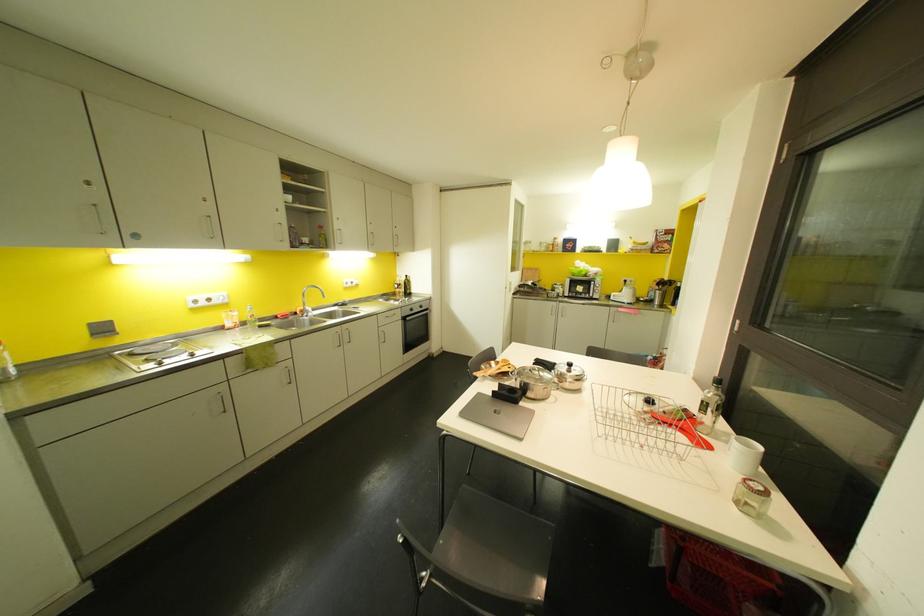
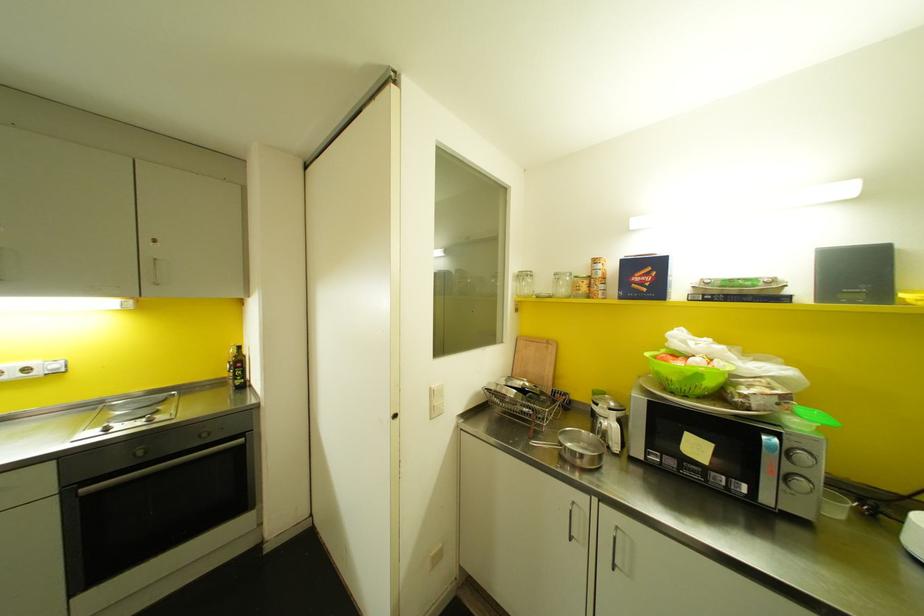
Where in the second image is the point corresponding to the point at 580,270 from the first image?

(698, 376)